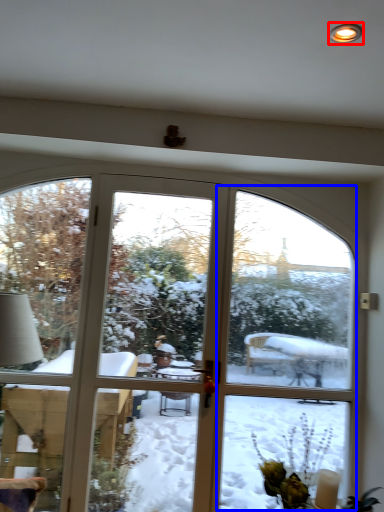
Question: Which of the following is the farthest to the observer, light (highlighted by a red box) or screen door (highlighted by a blue box)?

Choices:
 (A) light
 (B) screen door

Answer: (B)